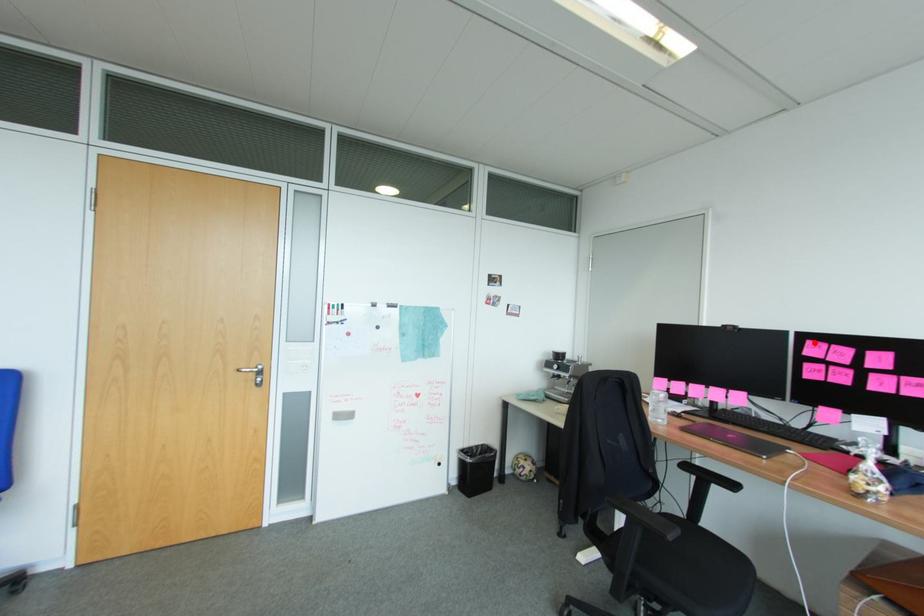
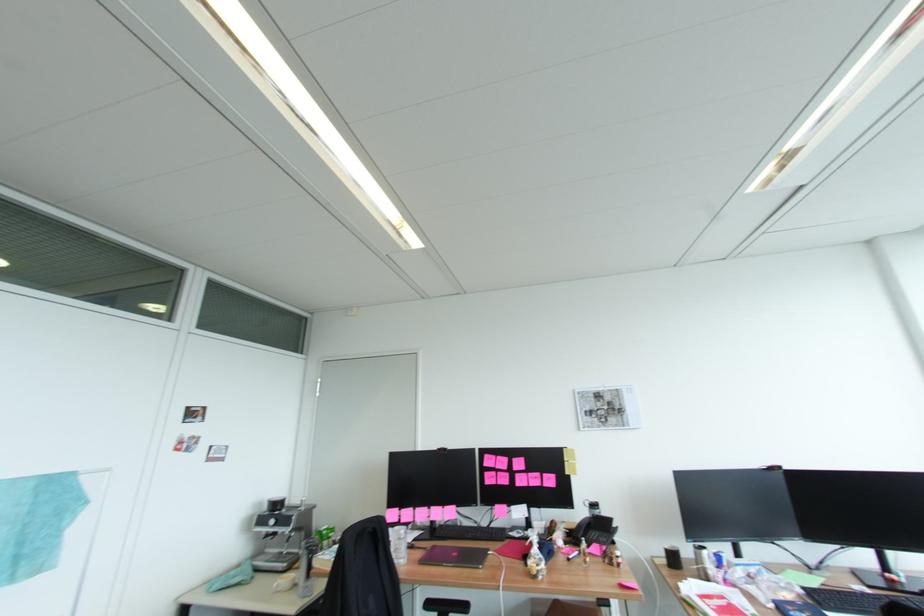
Where in the second image is the point corresponding to the highlighted location from the first image?

(492, 456)